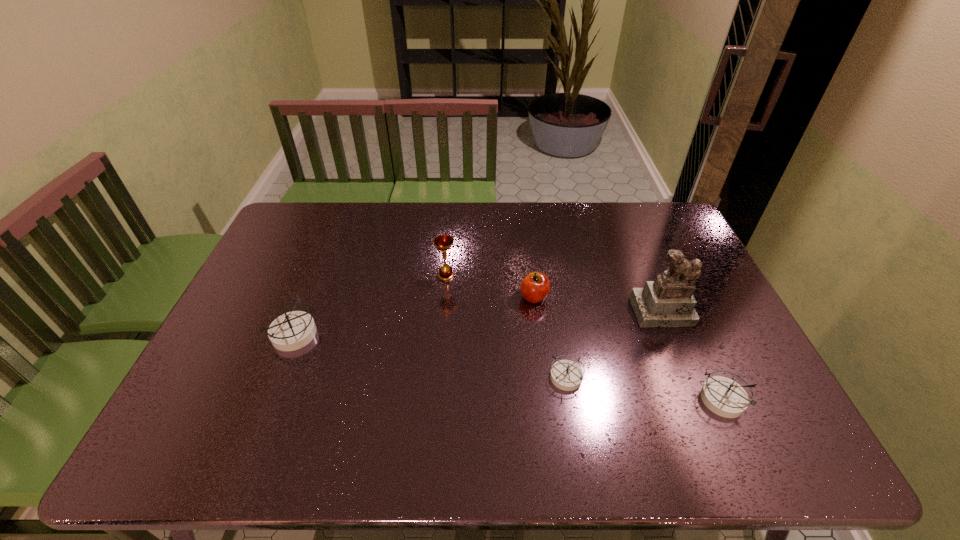
This screenshot has width=960, height=540. I want to click on vacant region located 0.160m on the back of the farthest compass, so click(316, 279).

What are the coordinates of `vacant space located 0.080m on the back of the shortest object` in the screenshot? It's located at click(x=560, y=338).

Locate an element on the screen. blank space located on the back of the rightmost compass is located at coordinates (677, 301).

The image size is (960, 540). In order to click on vacant space located 0.200m on the left of the second tallest object in this screenshot , I will do `click(373, 275)`.

The width and height of the screenshot is (960, 540). Identify the location of vacant area situated 0.270m on the front-facing side of the figurine. (706, 415).

This screenshot has width=960, height=540. Find the location of `vacant space located 0.060m on the front of the apple`. vacant space located 0.060m on the front of the apple is located at coordinates (538, 323).

Where is `object present at the left edge`? The width and height of the screenshot is (960, 540). object present at the left edge is located at coordinates (291, 331).

You are a GUI agent. You are given a task and a screenshot of the screen. Output one action in this format:
    pyautogui.click(x=<x>, y=<y>)
    Task: Click on the compass situated at the right edge
    This screenshot has width=960, height=540.
    Given the screenshot: What is the action you would take?
    pyautogui.click(x=723, y=396)

The height and width of the screenshot is (540, 960). I want to click on figurine located at the right edge, so pos(668,301).

This screenshot has width=960, height=540. Find the location of `object that is at the near right corner`. object that is at the near right corner is located at coordinates (723, 396).